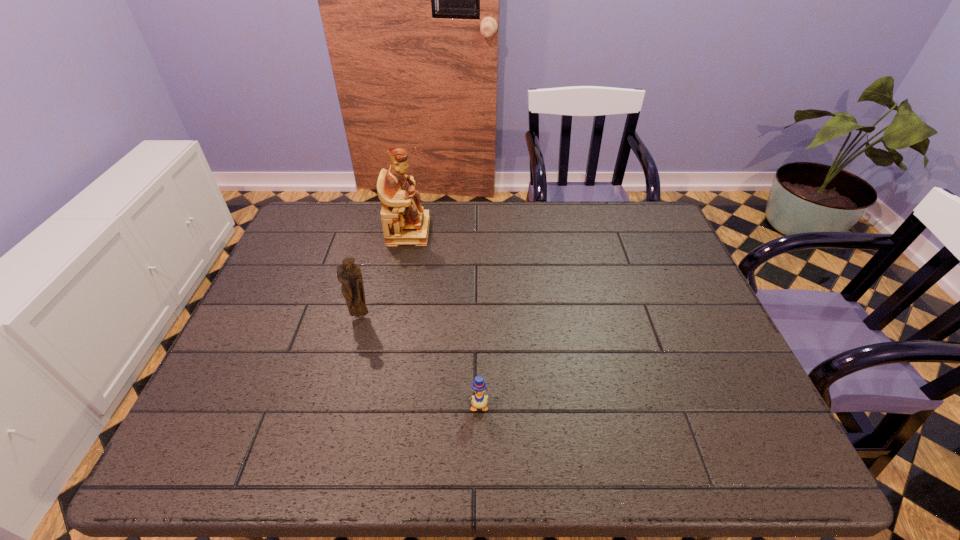
At what (x,y) coordinates should I click in order to perform the action: click on free space between the nearer figurine and the rightmost object. Please return your answer as a coordinate pair (x, y). This screenshot has height=540, width=960. Looking at the image, I should click on (420, 361).

At what (x,y) coordinates should I click in order to perform the action: click on blank region between the duckling and the second farthest object. Please return your answer as a coordinate pair (x, y). Looking at the image, I should click on (420, 361).

Locate an element on the screen. The image size is (960, 540). free spot between the nearest object and the taller figurine is located at coordinates (444, 319).

The width and height of the screenshot is (960, 540). I want to click on free area in between the rightmost object and the second nearest object, so click(x=420, y=361).

Where is `free space between the shorter figurine and the shortest object`? free space between the shorter figurine and the shortest object is located at coordinates (420, 361).

The height and width of the screenshot is (540, 960). In order to click on vacant region between the shortest object and the nearer figurine in this screenshot , I will do `click(420, 361)`.

Locate an element on the screen. Image resolution: width=960 pixels, height=540 pixels. empty location between the shorter figurine and the farther figurine is located at coordinates (385, 274).

Find the location of a particular element. Image resolution: width=960 pixels, height=540 pixels. object that is the second closest to the nearer figurine is located at coordinates (479, 400).

Identify the location of object that ranks as the second closest to the shortest object. This screenshot has height=540, width=960. (404, 222).

The height and width of the screenshot is (540, 960). What are the coordinates of `free space that satisfies the following two spatial constraints: 1. on the front-facing side of the farthest object; 2. on the front-facing side of the nearer figurine` in the screenshot? It's located at (392, 316).